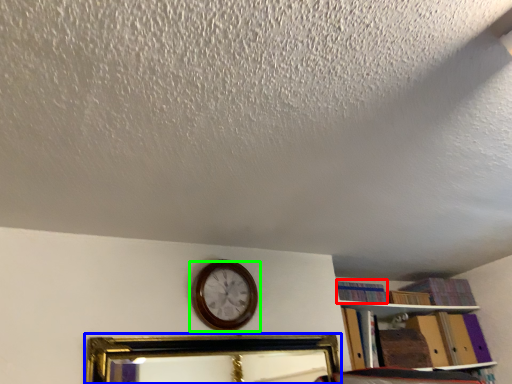
Question: Which object is positioned farthest from book (highlighted by a red box)? Select from picture frame (highlighted by a blue box) and wall clock (highlighted by a green box).

Choices:
 (A) picture frame
 (B) wall clock

Answer: (A)